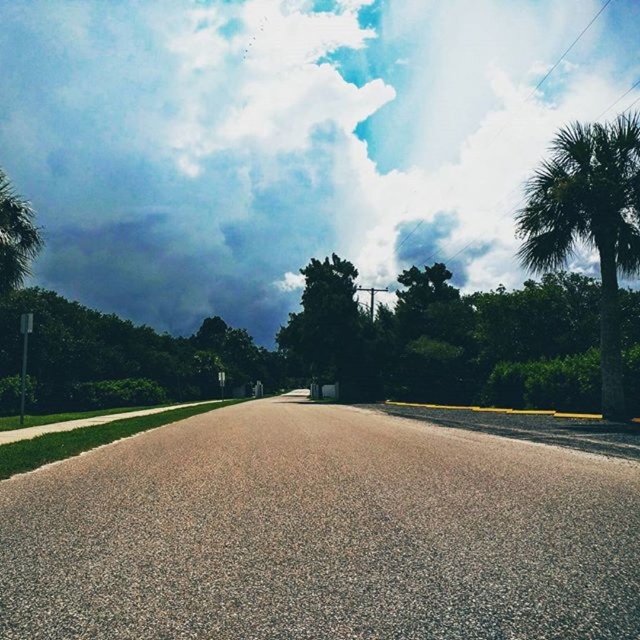
Question: Is cloudy sky at upper center bigger than green leafy palm tree at right?

Choices:
 (A) yes
 (B) no

Answer: (A)

Question: Among these objects, which one is nearest to the camera?

Choices:
 (A) cloudy sky at upper center
 (B) green leafy tree at center
 (C) green leafy palm tree at right

Answer: (C)

Question: Considering the real-world distances, which object is farthest from the green leafy tree at center?

Choices:
 (A) green leafy palm tree at right
 (B) cloudy sky at upper center

Answer: (B)

Question: Is green leafy palm tree at right below green leafy tree at center?

Choices:
 (A) no
 (B) yes

Answer: (A)

Question: Which point is farther to the camera?

Choices:
 (A) (556, 250)
 (B) (582, 68)
 (C) (304, 291)

Answer: (B)

Question: Where is cloudy sky at upper center located in relation to green leafy tree at center in the image?

Choices:
 (A) right
 (B) left

Answer: (B)